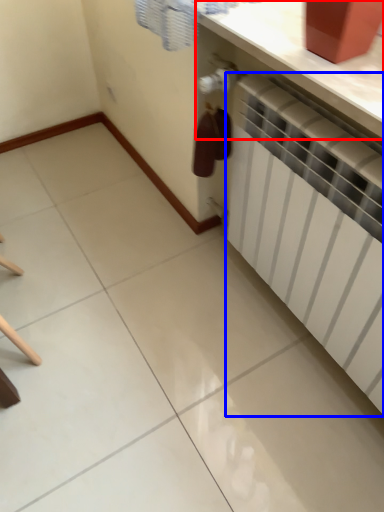
Question: Which of the following is the farthest to the observer, counter top (highlighted by a red box) or radiator (highlighted by a blue box)?

Choices:
 (A) counter top
 (B) radiator

Answer: (A)